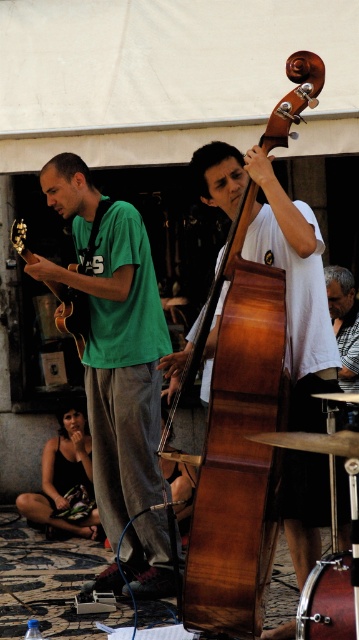
Who is lower down, black fabric dress at lower left or metallic silver drum at lower right?

Positioned lower is metallic silver drum at lower right.

Is black fabric dress at lower left wider than metallic silver drum at lower right?

Correct, the width of black fabric dress at lower left exceeds that of metallic silver drum at lower right.

The height and width of the screenshot is (640, 359). Identify the location of black fabric dress at lower left. (63, 476).

Where is `black fabric dress at lower left`? The width and height of the screenshot is (359, 640). black fabric dress at lower left is located at coordinates [x=63, y=476].

Consider the image. Can you confirm if wooden polished cello at center is positioned below metallic silver drum at lower right?

Actually, wooden polished cello at center is above metallic silver drum at lower right.

Is wooden polished cello at center wider than metallic silver drum at lower right?

Correct, the width of wooden polished cello at center exceeds that of metallic silver drum at lower right.

Between point (283, 104) and point (348, 554), which one is positioned behind?

Positioned behind is point (283, 104).

This screenshot has height=640, width=359. In order to click on wooden polished cello at center in this screenshot , I will do coord(227,276).

Does wooden polished cello at center appear over black fabric dress at lower left?

Correct, wooden polished cello at center is located above black fabric dress at lower left.

Identify the location of wooden polished cello at center. (227, 276).

Where is `wooden polished cello at center`? wooden polished cello at center is located at coordinates (227, 276).